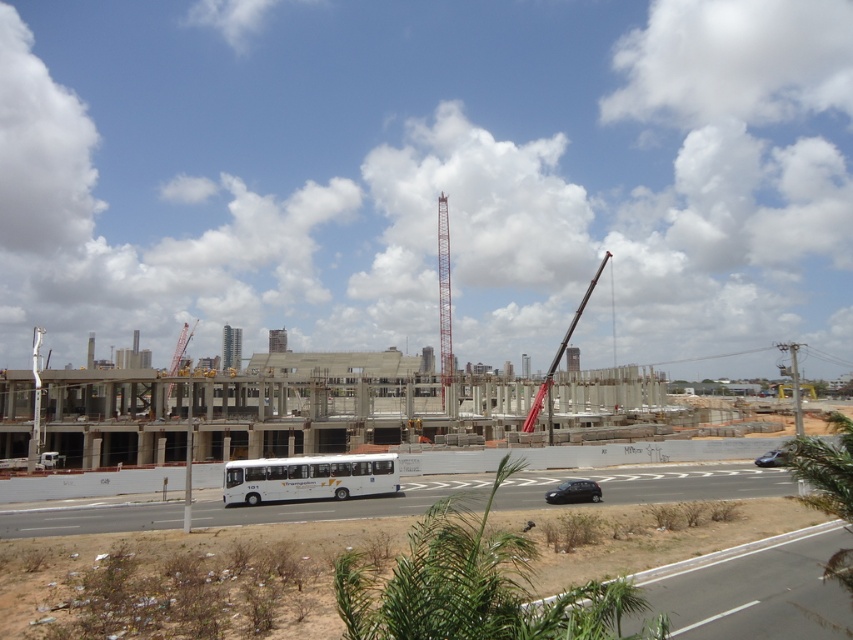
Between white matte bus at center and shiny black sedan at lower right, which one has less height?

white matte bus at center is shorter.

Does white matte bus at center have a greater height compared to shiny black sedan at lower right?

Incorrect, white matte bus at center's height is not larger of shiny black sedan at lower right's.

Which is behind, point (299, 460) or point (757, 465)?

The point (757, 465) is behind.

Locate an element on the screen. Image resolution: width=853 pixels, height=640 pixels. white matte bus at center is located at coordinates pos(309,477).

Does red painted metal tower crane at center have a lesser width compared to black matte car at lower center?

Yes.

Is red painted metal tower crane at center closer to the viewer compared to black matte car at lower center?

That is False.

Identify the location of red painted metal tower crane at center. (444, 300).

Which is in front, point (440, 307) or point (763, 456)?

Point (763, 456) is in front.

Is red painted metal tower crane at center below shiny black sedan at lower right?

No, red painted metal tower crane at center is not below shiny black sedan at lower right.

Which is in front, point (444, 232) or point (769, 456)?

Point (769, 456) is in front.

This screenshot has height=640, width=853. Identify the location of red painted metal tower crane at center. (444, 300).